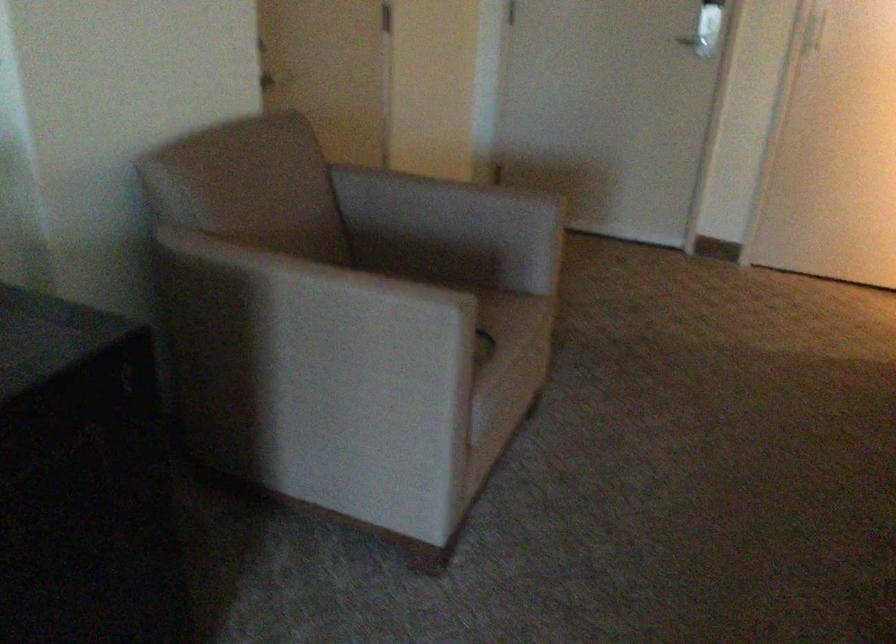
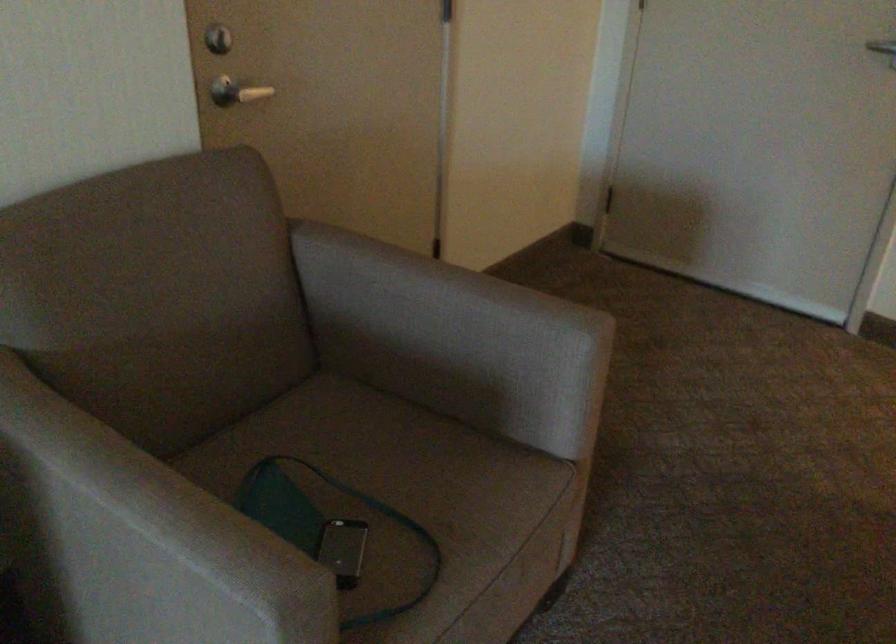
Locate, in the second image, the point that corresponds to (x=273, y=71) in the first image.

(236, 91)